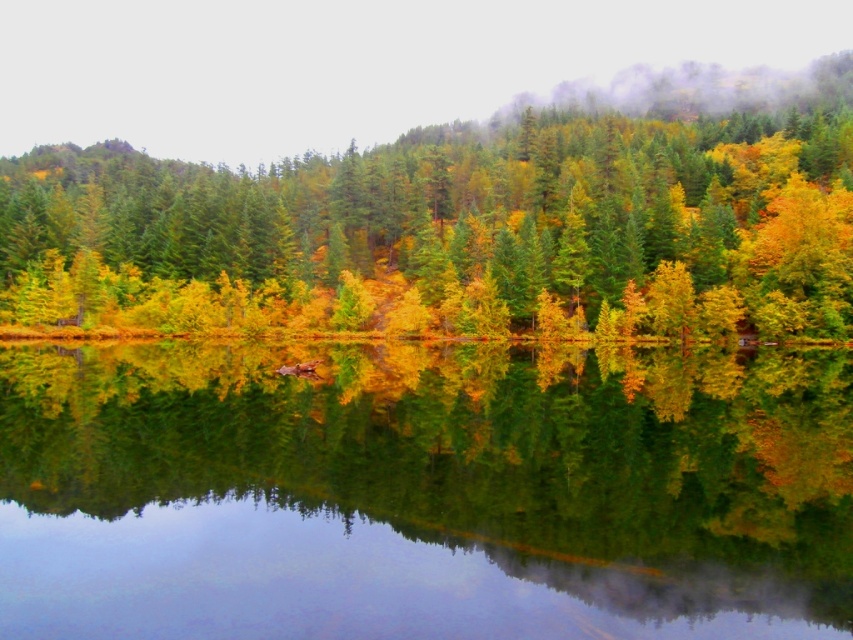
Question: Which object is closer to the camera taking this photo?

Choices:
 (A) yellow-green foliage at center
 (B) transparent water at center

Answer: (B)

Question: Is the position of transparent water at center less distant than that of yellow-green foliage at center?

Choices:
 (A) yes
 (B) no

Answer: (A)

Question: In this image, where is transparent water at center located relative to yellow-green foliage at center?

Choices:
 (A) right
 (B) left

Answer: (A)

Question: Is transparent water at center smaller than yellow-green foliage at center?

Choices:
 (A) no
 (B) yes

Answer: (B)